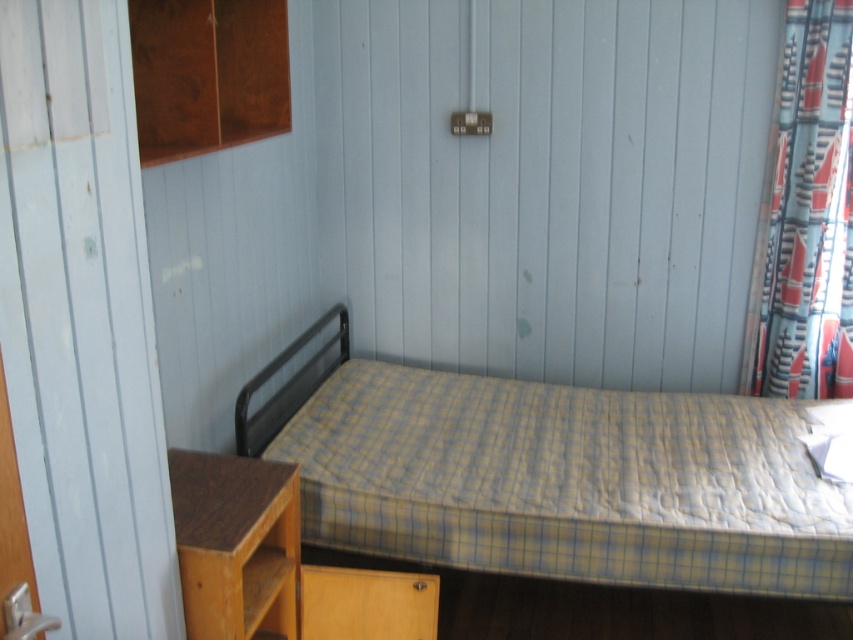
Question: Is the position of yellow checkered mattress at center more distant than that of patterned fabric curtain at right?

Choices:
 (A) no
 (B) yes

Answer: (A)

Question: Can you confirm if yellow checkered mattress at center is positioned to the right of patterned fabric curtain at right?

Choices:
 (A) no
 (B) yes

Answer: (A)

Question: Among these objects, which one is nearest to the camera?

Choices:
 (A) wooden cabinet at upper left
 (B) yellow checkered mattress at center

Answer: (A)

Question: Among these points, which one is farthest from the camera?

Choices:
 (A) (177, 92)
 (B) (830, 179)
 (C) (665, 420)

Answer: (C)

Question: Which of the following is the closest to the observer?

Choices:
 (A) (392, 504)
 (B) (811, 176)

Answer: (A)

Question: Is yellow checkered mattress at center positioned in front of wooden cabinet at upper left?

Choices:
 (A) no
 (B) yes

Answer: (A)